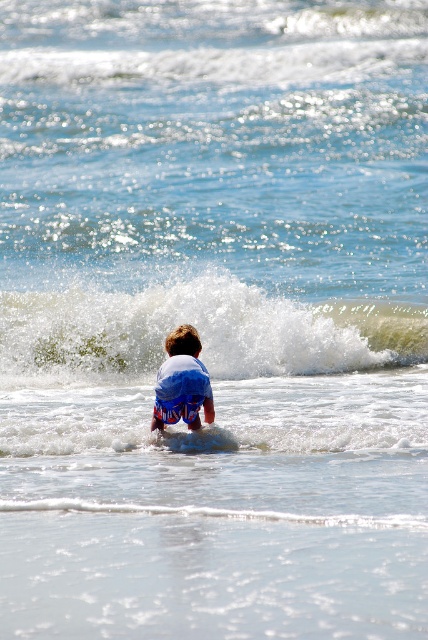
You are a photographer trying to capture the child in the scene. Since the white frothy wave at center and blue cotton shorts at center are both at the center, which one is wider so that it can be better framed in the photo?

The white frothy wave at center is wider than the blue cotton shorts at center, so it can be better framed in the photo.

You are a lifeguard on duty and notice the white frothy wave at center and the smooth blue surfboard at center in the water. Which object is higher in the scene?

The white frothy wave at center is above the smooth blue surfboard at center, so the white frothy wave at center is higher in the scene.

You are a photographer taking a picture of the beach scene. You want to ensure the blue cotton shorts at center and the smooth blue surfboard at center are both visible in the frame. Which object should you focus on first to capture both in the shot?

You should focus on the blue cotton shorts at center first because it is located above the smooth blue surfboard at center, so adjusting the focus on the higher positioned shorts will help ensure both objects are in the frame.